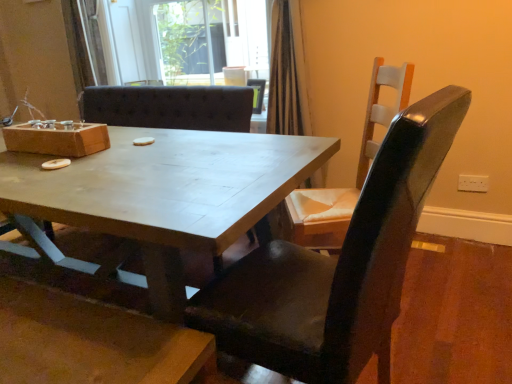
Question: Is transparent glass door at upper center far from matte black chair at center, which appears as the first chair when viewed from the front?

Choices:
 (A) yes
 (B) no

Answer: (A)

Question: Can you see transparent glass door at upper center touching matte black chair at center, the second chair positioned from the back?

Choices:
 (A) yes
 (B) no

Answer: (B)

Question: Would you say matte black chair at center, the second chair positioned from the back, is part of transparent glass door at upper center's contents?

Choices:
 (A) no
 (B) yes

Answer: (A)

Question: Could you tell me if transparent glass door at upper center is facing matte black chair at center, which appears as the first chair when viewed from the front?

Choices:
 (A) yes
 (B) no

Answer: (B)

Question: Is transparent glass door at upper center closer to camera compared to matte black chair at center, which appears as the first chair when viewed from the front?

Choices:
 (A) yes
 (B) no

Answer: (B)

Question: From the image's perspective, would you say transparent glass door at upper center is positioned over matte black chair at center, the second chair positioned from the back?

Choices:
 (A) no
 (B) yes

Answer: (B)

Question: Is wooden chair at right, acting as the second chair starting from the front, to the right of matte black chair at center, which appears as the first chair when viewed from the front, from the viewer's perspective?

Choices:
 (A) no
 (B) yes

Answer: (B)

Question: From the image's perspective, is wooden chair at right, acting as the second chair starting from the front, located beneath matte black chair at center, the second chair positioned from the back?

Choices:
 (A) yes
 (B) no

Answer: (B)

Question: From a real-world perspective, is wooden chair at right, acting as the first chair starting from the back, beneath matte black chair at center, the second chair positioned from the back?

Choices:
 (A) no
 (B) yes

Answer: (A)

Question: Is matte black chair at center, which appears as the first chair when viewed from the front, a part of wooden chair at right, acting as the second chair starting from the front?

Choices:
 (A) no
 (B) yes

Answer: (A)

Question: Is wooden chair at right, acting as the first chair starting from the back, at the left side of matte black chair at center, which appears as the first chair when viewed from the front?

Choices:
 (A) no
 (B) yes

Answer: (A)

Question: Does wooden chair at right, acting as the first chair starting from the back, have a lesser height compared to matte black chair at center, the second chair positioned from the back?

Choices:
 (A) no
 (B) yes

Answer: (B)

Question: Is wooden chair at right, acting as the second chair starting from the front, looking in the opposite direction of matte wooden table at center?

Choices:
 (A) no
 (B) yes

Answer: (A)